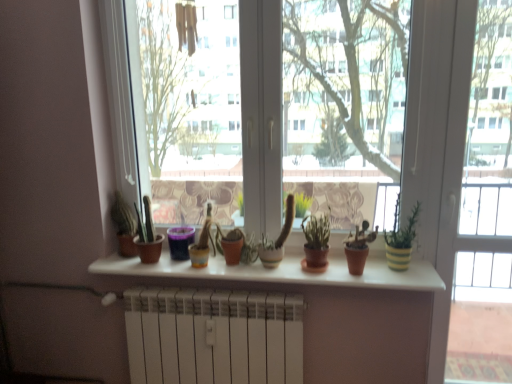
Question: Does green matte plant at center, which is the second houseplant from right to left, have a smaller size compared to purple plastic cup at center, the first flowerpot when ordered from left to right?

Choices:
 (A) yes
 (B) no

Answer: (B)

Question: Considering the relative sizes of green matte plant at center, which is the second houseplant from right to left, and purple plastic cup at center, which ranks as the 2th flowerpot in right-to-left order, in the image provided, is green matte plant at center, which is the second houseplant from right to left, wider than purple plastic cup at center, which ranks as the 2th flowerpot in right-to-left order,?

Choices:
 (A) no
 (B) yes

Answer: (B)

Question: From a real-world perspective, is green matte plant at center, which is the second houseplant from right to left, located higher than purple plastic cup at center, which ranks as the 2th flowerpot in right-to-left order?

Choices:
 (A) yes
 (B) no

Answer: (A)

Question: Can you confirm if green matte plant at center, which is the 1th houseplant from left to right, is shorter than purple plastic cup at center, the first flowerpot when ordered from left to right?

Choices:
 (A) no
 (B) yes

Answer: (A)

Question: Is green matte plant at center, which is the second houseplant from right to left, closer to camera compared to purple plastic cup at center, the first flowerpot when ordered from left to right?

Choices:
 (A) yes
 (B) no

Answer: (A)

Question: Based on their positions, is green matte plant at center, which is the second houseplant from right to left, located to the left or right of transparent glass window at center?

Choices:
 (A) right
 (B) left

Answer: (A)

Question: From a real-world perspective, relative to transparent glass window at center, is green matte plant at center, which is the second houseplant from right to left, vertically above or below?

Choices:
 (A) above
 (B) below

Answer: (B)

Question: Is green matte plant at center, which is the 1th houseplant from left to right, situated inside transparent glass window at center or outside?

Choices:
 (A) outside
 (B) inside

Answer: (A)

Question: From the image's perspective, relative to transparent glass window at center, is green matte plant at center, which is the second houseplant from right to left, above or below?

Choices:
 (A) below
 (B) above

Answer: (A)

Question: From their relative heights in the image, would you say white matte radiator at lower center is taller or shorter than matte white shelf at center?

Choices:
 (A) tall
 (B) short

Answer: (A)

Question: Do you think white matte radiator at lower center is within matte white shelf at center, or outside of it?

Choices:
 (A) outside
 (B) inside

Answer: (A)

Question: From the image's perspective, relative to matte white shelf at center, is white matte radiator at lower center above or below?

Choices:
 (A) below
 (B) above

Answer: (A)

Question: Looking at the image, does white matte radiator at lower center seem bigger or smaller compared to matte white shelf at center?

Choices:
 (A) small
 (B) big

Answer: (B)

Question: From a real-world perspective, relative to transparent glass window at center, is purple plastic cup at center, which ranks as the 2th flowerpot in right-to-left order, vertically above or below?

Choices:
 (A) above
 (B) below

Answer: (B)

Question: In the image, is purple plastic cup at center, which ranks as the 2th flowerpot in right-to-left order, positioned in front of or behind transparent glass window at center?

Choices:
 (A) behind
 (B) front

Answer: (A)